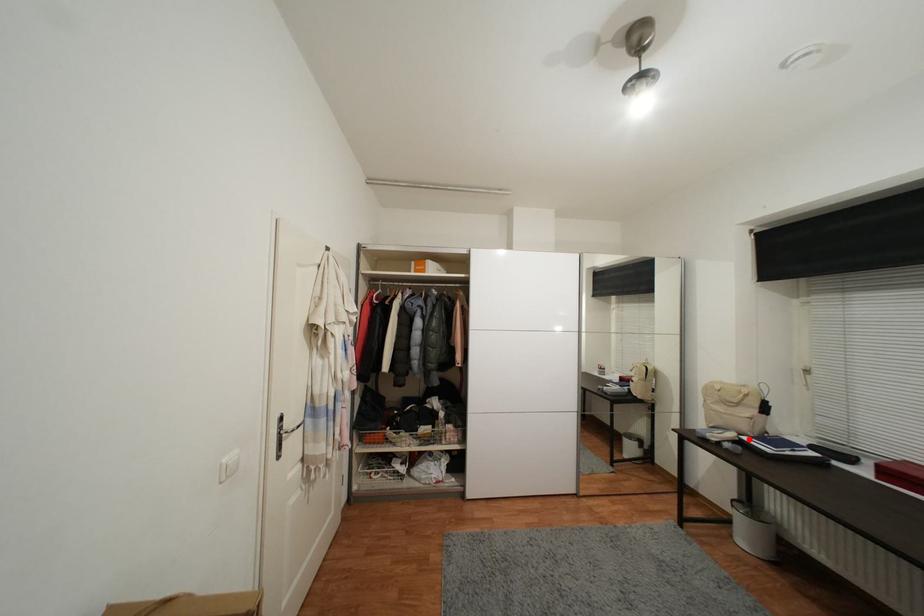
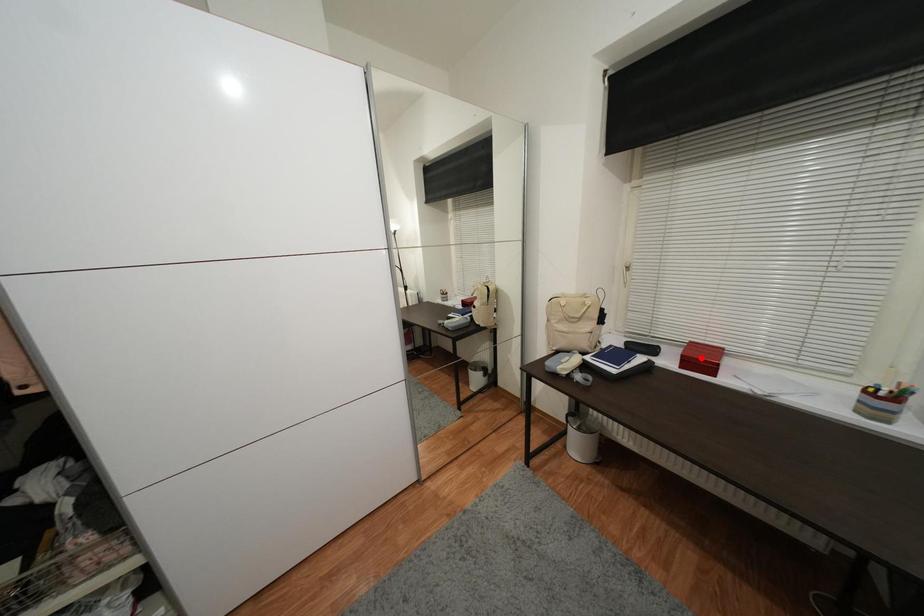
I am providing you with two images of the same scene from different viewpoints. A red point is marked on the first image and another point is marked on the second image. Is the red point in image1 aligned with the point shown in image2?

No